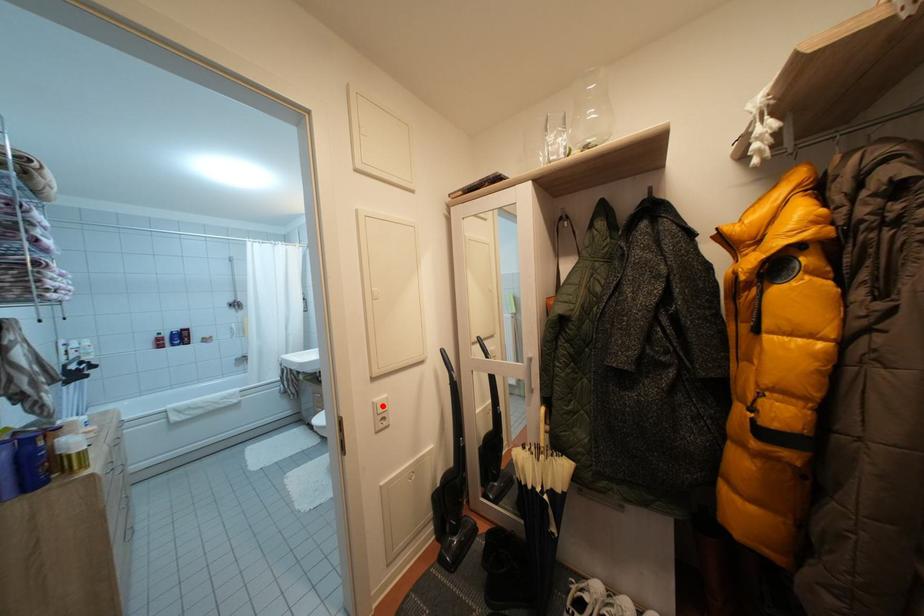
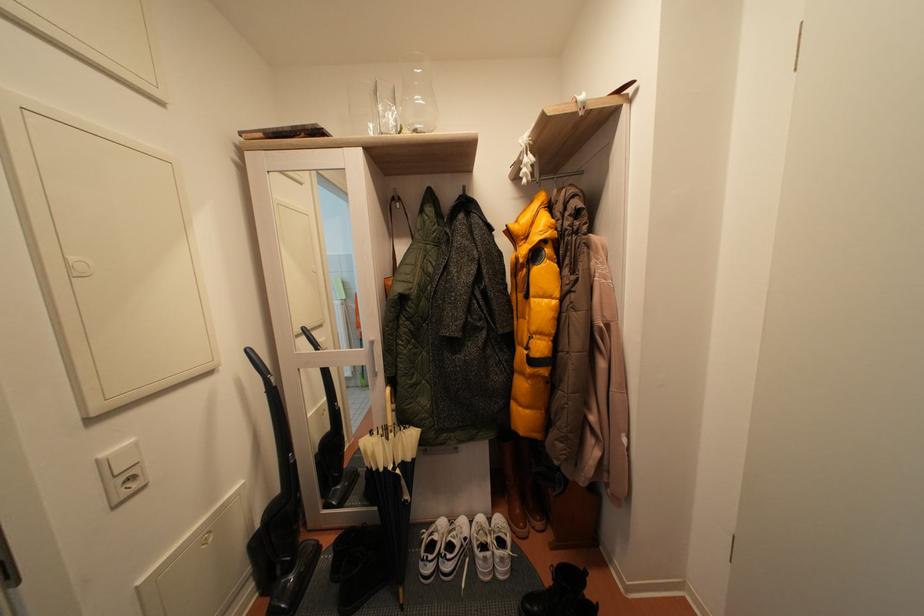
Question: I am providing you with two images of the same scene from different viewpoints. A red point is marked on the first image. At the location where the point appears in image 1, is it still visible in image 2?

Choices:
 (A) Yes
 (B) No

Answer: (A)